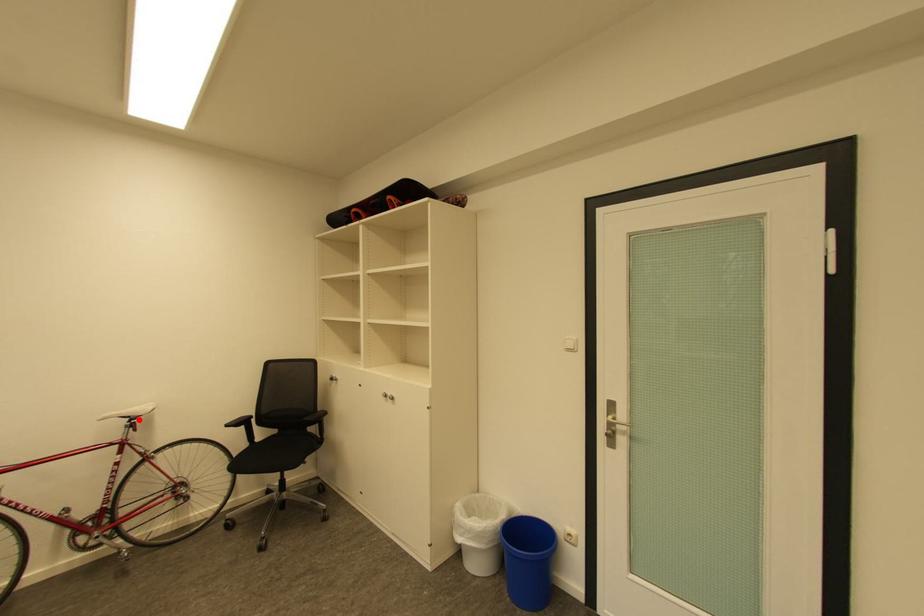
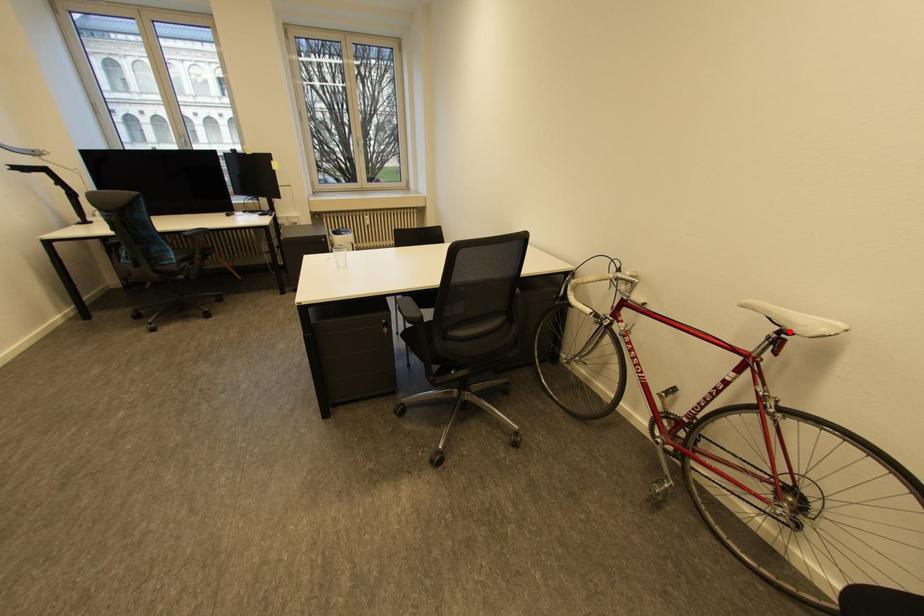
I am providing you with two images of the same scene from different viewpoints. A red point is marked on the first image and another point is marked on the second image. Do the highlighted points in image1 and image2 indicate the same real-world spot?

Yes